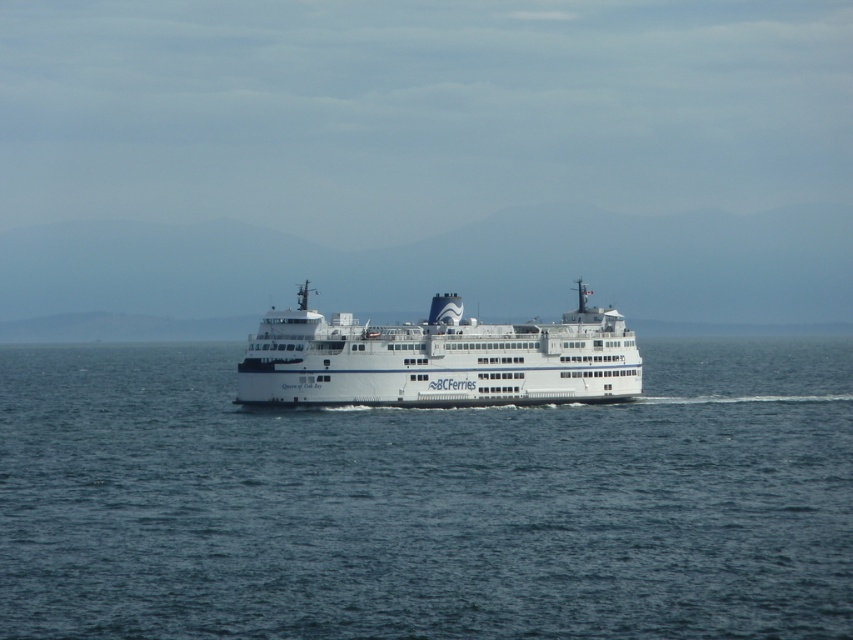
Can you confirm if blue water at center is positioned to the right of white matte ferry at center?

Incorrect, blue water at center is not on the right side of white matte ferry at center.

Does point (444, 628) come farther from viewer compared to point (335, 404)?

No, (444, 628) is closer to viewer.

Where is `blue water at center`? blue water at center is located at coordinates (426, 502).